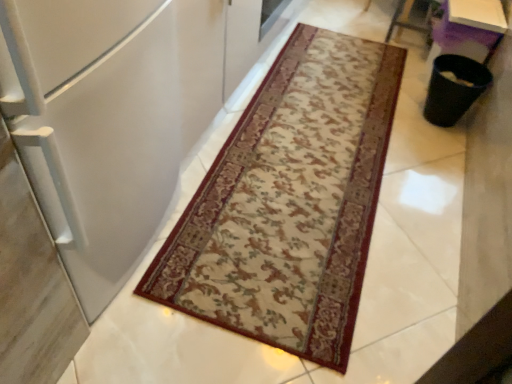
Question: Does white matte refrigerator at left have a greater height compared to purple plastic table at upper right?

Choices:
 (A) yes
 (B) no

Answer: (A)

Question: Can you confirm if white matte refrigerator at left is smaller than purple plastic table at upper right?

Choices:
 (A) yes
 (B) no

Answer: (B)

Question: Is white matte refrigerator at left looking in the opposite direction of purple plastic table at upper right?

Choices:
 (A) no
 (B) yes

Answer: (A)

Question: Is white matte refrigerator at left positioned beyond the bounds of purple plastic table at upper right?

Choices:
 (A) yes
 (B) no

Answer: (A)

Question: Is white matte refrigerator at left touching purple plastic table at upper right?

Choices:
 (A) yes
 (B) no

Answer: (B)

Question: From the image's perspective, is white matte refrigerator at left located above or below beige carpet with floral pattern at center?

Choices:
 (A) above
 (B) below

Answer: (A)

Question: In the image, is white matte refrigerator at left on the left side or the right side of beige carpet with floral pattern at center?

Choices:
 (A) left
 (B) right

Answer: (A)

Question: Would you say white matte refrigerator at left is inside or outside beige carpet with floral pattern at center?

Choices:
 (A) inside
 (B) outside

Answer: (B)

Question: Is white matte refrigerator at left bigger or smaller than beige carpet with floral pattern at center?

Choices:
 (A) big
 (B) small

Answer: (A)

Question: Based on their positions, is beige carpet with floral pattern at center located to the left or right of white matte refrigerator at left?

Choices:
 (A) left
 (B) right

Answer: (B)

Question: Is beige carpet with floral pattern at center inside the boundaries of white matte refrigerator at left, or outside?

Choices:
 (A) inside
 (B) outside

Answer: (B)

Question: Relative to white matte refrigerator at left, is beige carpet with floral pattern at center in front or behind?

Choices:
 (A) front
 (B) behind

Answer: (B)

Question: From the image's perspective, relative to white matte refrigerator at left, is beige carpet with floral pattern at center above or below?

Choices:
 (A) below
 (B) above

Answer: (A)

Question: From a real-world perspective, relative to beige carpet with floral pattern at center, is purple plastic table at upper right vertically above or below?

Choices:
 (A) below
 (B) above

Answer: (B)

Question: From the image's perspective, relative to beige carpet with floral pattern at center, is purple plastic table at upper right above or below?

Choices:
 (A) above
 (B) below

Answer: (A)